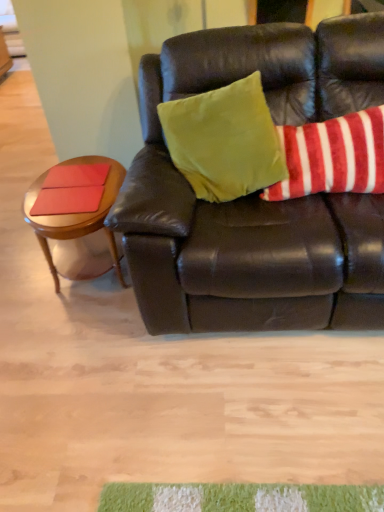
This screenshot has height=512, width=384. In order to click on vacant region under matte red pad at left, placed as the 1th pad when sorted from front to back (from a real-world perspective) in this screenshot , I will do `click(69, 202)`.